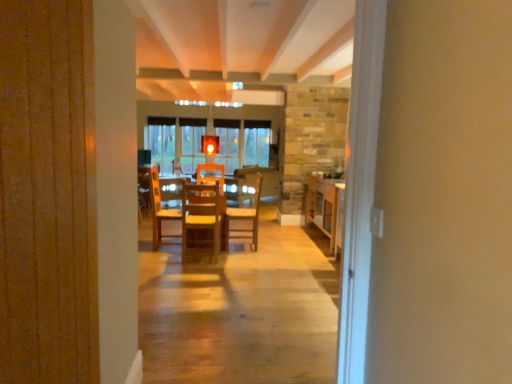
The width and height of the screenshot is (512, 384). In order to click on wooden chair at center, which appears as the first chair when viewed from the back in this screenshot , I will do `click(245, 218)`.

What do you see at coordinates (326, 208) in the screenshot? Image resolution: width=512 pixels, height=384 pixels. I see `wooden table at right, which ranks as the 1th table in right-to-left order` at bounding box center [326, 208].

This screenshot has height=384, width=512. I want to click on wooden table at center, the second table viewed from the right, so click(159, 201).

From the image's perspective, does wooden chair at center, placed as the 2th chair when sorted from back to front, appear higher than wooden chair at center, which is counted as the 2th chair, starting from the front?

No, from the image's perspective, wooden chair at center, placed as the 2th chair when sorted from back to front, is not above wooden chair at center, which is counted as the 2th chair, starting from the front.

From a real-world perspective, does wooden chair at center, which ranks as the 1th chair in front-to-back order, stand above wooden chair at center, which is the second chair in left-to-right order?

Indeed, from a real-world perspective, wooden chair at center, which ranks as the 1th chair in front-to-back order, stands above wooden chair at center, which is the second chair in left-to-right order.

Does wooden chair at center, positioned as the 1th chair in left-to-right order, have a lesser height compared to wooden chair at center, which appears as the first chair when viewed from the right?

Yes, wooden chair at center, positioned as the 1th chair in left-to-right order, is shorter than wooden chair at center, which appears as the first chair when viewed from the right.

How many degrees apart are the facing directions of wooden chair at center, placed as the 2th chair when sorted from back to front, and wooden chair at center, which appears as the first chair when viewed from the back?

The angular difference between wooden chair at center, placed as the 2th chair when sorted from back to front, and wooden chair at center, which appears as the first chair when viewed from the back, is 90.5 degrees.

Identify the location of the 1st table behind the wooden chair at center, placed as the 2th chair when sorted from back to front. This screenshot has height=384, width=512. (159, 201).

From the image's perspective, is wooden table at center, the second table viewed from the right, over wooden chair at center, which ranks as the 1th chair in front-to-back order?

Incorrect, from the image's perspective, wooden table at center, the second table viewed from the right, is lower than wooden chair at center, which ranks as the 1th chair in front-to-back order.

Based on the photo, from a real-world perspective, who is located lower, wooden table at right, which ranks as the 1th table in right-to-left order, or wooden table at center, arranged as the first table when viewed from the left?

In real-world perspective, wooden table at center, arranged as the first table when viewed from the left, is lower.

Are wooden table at right, which ranks as the 1th table in right-to-left order, and wooden table at center, arranged as the first table when viewed from the left, far apart?

Absolutely, wooden table at right, which ranks as the 1th table in right-to-left order, is distant from wooden table at center, arranged as the first table when viewed from the left.

Does wooden table at right, the second table viewed from the left, turn towards wooden table at center, arranged as the first table when viewed from the left?

Yes.

From a real-world perspective, does wooden table at center, the second table viewed from the right, sit lower than wooden chair at center, which appears as the first chair when viewed from the right?

Correct, in the physical world, wooden table at center, the second table viewed from the right, is lower than wooden chair at center, which appears as the first chair when viewed from the right.

Is wooden table at center, the second table viewed from the right, oriented towards wooden chair at center, which appears as the first chair when viewed from the right?

No, wooden table at center, the second table viewed from the right, is not turned towards wooden chair at center, which appears as the first chair when viewed from the right.

Is wooden table at center, the second table viewed from the right, at the left side of wooden chair at center, which appears as the first chair when viewed from the back?

Yes.

How many degrees apart are the facing directions of wooden table at center, arranged as the first table when viewed from the left, and wooden chair at center, which is the second chair in left-to-right order?

90.3 degrees.

Is wooden chair at center, which is the second chair in left-to-right order, to the right of wooden chair at center, placed as the 2th chair when sorted from back to front, from the viewer's perspective?

Correct, you'll find wooden chair at center, which is the second chair in left-to-right order, to the right of wooden chair at center, placed as the 2th chair when sorted from back to front.

Can we say wooden chair at center, which appears as the first chair when viewed from the right, lies outside wooden chair at center, arranged as the second chair when viewed from the right?

wooden chair at center, which appears as the first chair when viewed from the right, is positioned outside wooden chair at center, arranged as the second chair when viewed from the right.

Is point (253, 230) farther from camera compared to point (218, 202)?

That is True.

Is wooden chair at center, which appears as the first chair when viewed from the back, facing towards wooden chair at center, placed as the 2th chair when sorted from back to front?

No, wooden chair at center, which appears as the first chair when viewed from the back, is not oriented towards wooden chair at center, placed as the 2th chair when sorted from back to front.

From the image's perspective, is wooden chair at center, which appears as the first chair when viewed from the right, located above wooden table at right, which ranks as the 1th table in right-to-left order?

Incorrect, from the image's perspective, wooden chair at center, which appears as the first chair when viewed from the right, is lower than wooden table at right, which ranks as the 1th table in right-to-left order.

Considering the relative positions of wooden chair at center, which is the second chair in left-to-right order, and wooden table at right, the second table viewed from the left, in the image provided, is wooden chair at center, which is the second chair in left-to-right order, to the right of wooden table at right, the second table viewed from the left, from the viewer's perspective?

Incorrect, wooden chair at center, which is the second chair in left-to-right order, is not on the right side of wooden table at right, the second table viewed from the left.

From a real-world perspective, is wooden chair at center, which appears as the first chair when viewed from the right, positioned above or below wooden table at right, which ranks as the 1th table in right-to-left order?

In terms of real-world spatial position, wooden chair at center, which appears as the first chair when viewed from the right, is above wooden table at right, which ranks as the 1th table in right-to-left order.

Would you consider wooden chair at center, which is counted as the 2th chair, starting from the front, to be distant from wooden table at right, the second table viewed from the left?

wooden chair at center, which is counted as the 2th chair, starting from the front, is positioned a significant distance from wooden table at right, the second table viewed from the left.

From a real-world perspective, is wooden table at center, the second table viewed from the right, over wooden table at right, which ranks as the 1th table in right-to-left order?

No, from a real-world perspective, wooden table at center, the second table viewed from the right, is not on top of wooden table at right, which ranks as the 1th table in right-to-left order.

Would you say wooden table at right, the second table viewed from the left, is part of wooden table at center, arranged as the first table when viewed from the left,'s contents?

No, wooden table at right, the second table viewed from the left, is not surrounded by wooden table at center, arranged as the first table when viewed from the left.

Which is behind, point (165, 217) or point (329, 190)?

The point (329, 190) is more distant.

Which object is further away from the camera, wooden table at center, arranged as the first table when viewed from the left, or wooden table at right, which ranks as the 1th table in right-to-left order?

Positioned behind is wooden table at right, which ranks as the 1th table in right-to-left order.

Locate an element on the screen. This screenshot has width=512, height=384. chair below the wooden chair at center, which appears as the first chair when viewed from the right (from the image's perspective) is located at coordinates (202, 217).

The image size is (512, 384). Identify the location of the 1st table behind the wooden chair at center, arranged as the second chair when viewed from the right. (159, 201).

Looking at the image, which one is located further to wooden table at right, the second table viewed from the left, wooden chair at center, positioned as the 1th chair in left-to-right order, or wooden table at center, the second table viewed from the right?

wooden table at center, the second table viewed from the right.

When comparing their distances from wooden chair at center, which ranks as the 1th chair in front-to-back order, does wooden table at right, which ranks as the 1th table in right-to-left order, or wooden chair at center, which appears as the first chair when viewed from the back, seem further?

Among the two, wooden table at right, which ranks as the 1th table in right-to-left order, is located further to wooden chair at center, which ranks as the 1th chair in front-to-back order.

Consider the image. Based on their spatial positions, is wooden chair at center, arranged as the second chair when viewed from the right, or wooden chair at center, which appears as the first chair when viewed from the right, further from wooden table at center, the second table viewed from the right?

Based on the image, wooden chair at center, which appears as the first chair when viewed from the right, appears to be further to wooden table at center, the second table viewed from the right.

From the picture: Which object lies nearer to the anchor point wooden chair at center, which appears as the first chair when viewed from the right, wooden table at center, the second table viewed from the right, or wooden table at right, the second table viewed from the left?

Among the two, wooden table at center, the second table viewed from the right, is located nearer to wooden chair at center, which appears as the first chair when viewed from the right.

Considering their positions, is wooden chair at center, which appears as the first chair when viewed from the back, positioned further to wooden table at center, arranged as the first table when viewed from the left, than wooden table at right, the second table viewed from the left?

wooden table at right, the second table viewed from the left, is positioned further to the anchor wooden table at center, arranged as the first table when viewed from the left.

Estimate the real-world distances between objects in this image. Which object is further from wooden table at right, which ranks as the 1th table in right-to-left order, wooden chair at center, which is counted as the 2th chair, starting from the front, or wooden table at center, the second table viewed from the right?

Among the two, wooden table at center, the second table viewed from the right, is located further to wooden table at right, which ranks as the 1th table in right-to-left order.

Looking at the image, which one is located further to wooden table at right, the second table viewed from the left, wooden chair at center, which appears as the first chair when viewed from the back, or wooden chair at center, which ranks as the 1th chair in front-to-back order?

The object further to wooden table at right, the second table viewed from the left, is wooden chair at center, which ranks as the 1th chair in front-to-back order.

Estimate the real-world distances between objects in this image. Which object is further from wooden chair at center, which appears as the first chair when viewed from the right, wooden table at center, the second table viewed from the right, or wooden chair at center, placed as the 2th chair when sorted from back to front?

Among the two, wooden table at center, the second table viewed from the right, is located further to wooden chair at center, which appears as the first chair when viewed from the right.

Locate an element on the screen. This screenshot has height=384, width=512. chair between wooden chair at center, placed as the 2th chair when sorted from back to front, and wooden table at right, which ranks as the 1th table in right-to-left order, from left to right is located at coordinates (245, 218).

Locate an element on the screen. chair between wooden table at center, the second table viewed from the right, and wooden table at right, the second table viewed from the left is located at coordinates (245, 218).

You are a GUI agent. You are given a task and a screenshot of the screen. Output one action in this format:
    pyautogui.click(x=<x>, y=<y>)
    Task: Click on the table located between wooden chair at center, positioned as the 1th chair in left-to-right order, and wooden table at right, which ranks as the 1th table in right-to-left order, in the left-right direction
    This screenshot has height=384, width=512.
    Given the screenshot: What is the action you would take?
    pyautogui.click(x=159, y=201)